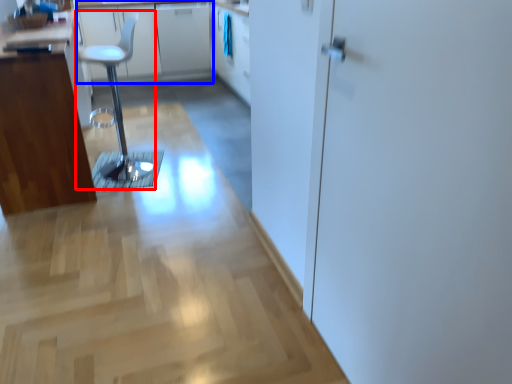
Question: Which object is closer to the camera taking this photo, step stool (highlighted by a red box) or counter top (highlighted by a blue box)?

Choices:
 (A) step stool
 (B) counter top

Answer: (A)